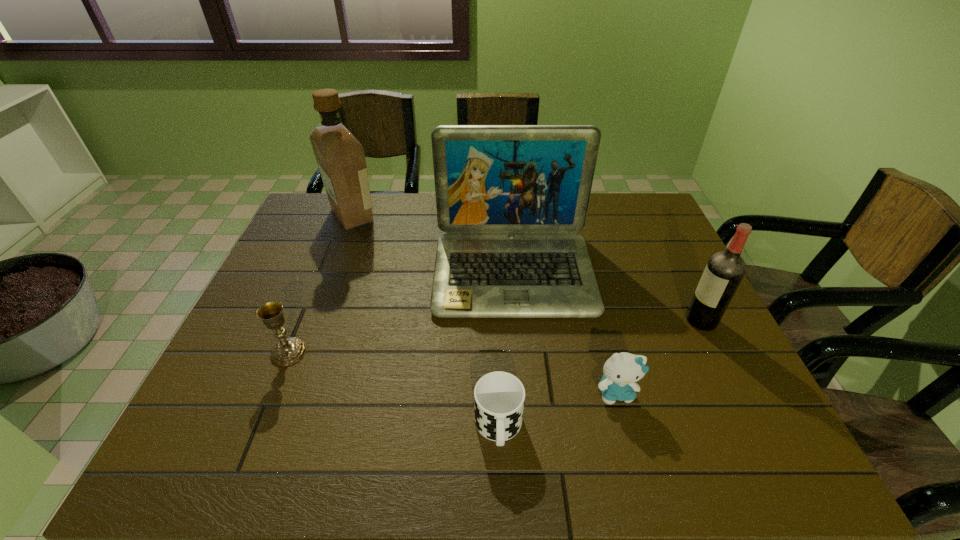
Locate an element on the screen. This screenshot has height=540, width=960. object located at the right edge is located at coordinates (724, 271).

Find the location of a particular element. This screenshot has height=540, width=960. object at the far left corner is located at coordinates [340, 157].

In the image, there is a desktop. In order to click on vacant space at the far edge in this screenshot , I will do `click(394, 198)`.

What are the coordinates of `free space at the near edge of the desktop` in the screenshot? It's located at click(x=629, y=470).

In order to click on vacant space at the left edge of the desktop in this screenshot , I will do `click(256, 355)`.

Locate an element on the screen. The height and width of the screenshot is (540, 960). free space at the right edge is located at coordinates (678, 385).

I want to click on vacant space at the far right corner of the desktop, so click(x=635, y=215).

Find the location of a particular element. The width and height of the screenshot is (960, 540). free space between the taller liquor and the chalice is located at coordinates (321, 284).

Locate an element on the screen. free point between the laptop computer and the cup is located at coordinates (506, 350).

Find the location of a particular element. This screenshot has width=960, height=540. free point between the rightmost object and the laptop computer is located at coordinates point(608,297).